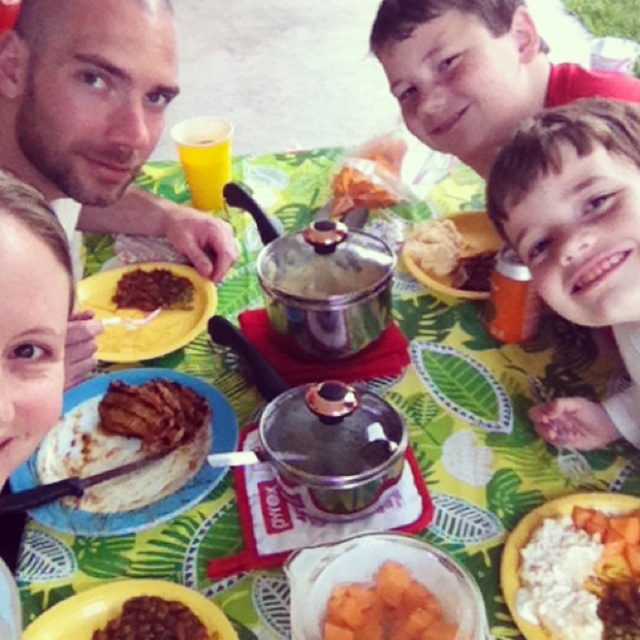
Measure the distance from white creamy rice at center to brown matte chili at center.

A distance of 20.73 inches exists between white creamy rice at center and brown matte chili at center.

Does point (595, 556) lie behind point (152, 301)?

No, it is not.

Find the location of a particular element. This screenshot has height=640, width=640. white creamy rice at center is located at coordinates (576, 568).

Who is more forward, [429,624] or [152,616]?

Point [429,624] is more forward.

Which is more to the right, orange matte sweet potato at center or dark red glossy chili at center?

orange matte sweet potato at center is more to the right.

Between point (384, 621) and point (147, 602), which one is positioned behind?

Point (147, 602)

Where is `orange matte sweet potato at center`? orange matte sweet potato at center is located at coordinates coord(385,609).

Is brown matte/soft rice cake at center to the left of smooth brown rice at center from the viewer's perspective?

Correct, you'll find brown matte/soft rice cake at center to the left of smooth brown rice at center.

Between point (72, 419) and point (468, 289), which one is positioned in front?

Point (72, 419) is more forward.

You are a GUI agent. You are given a task and a screenshot of the screen. Output one action in this format:
    pyautogui.click(x=<x>, y=<y>)
    Task: Click on the brown matte/soft rice cake at center
    The height and width of the screenshot is (640, 640).
    Given the screenshot: What is the action you would take?
    pyautogui.click(x=129, y=444)